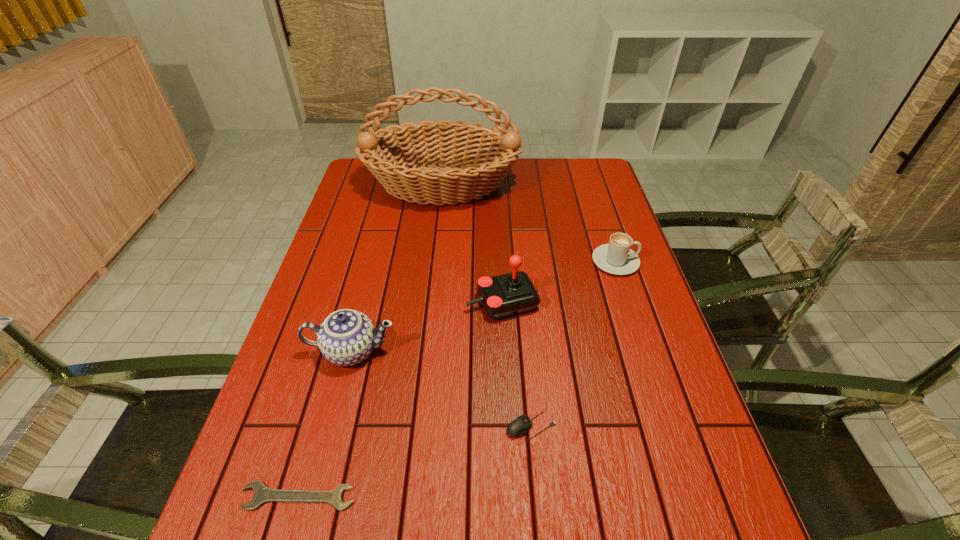
In order to click on wrench in this screenshot , I will do `click(263, 494)`.

The width and height of the screenshot is (960, 540). What are the coordinates of `the shortest object` in the screenshot? It's located at (263, 494).

The width and height of the screenshot is (960, 540). I want to click on blank area located on the right of the tallest object, so click(572, 185).

Find the location of a particular element. The width and height of the screenshot is (960, 540). vacant space located on the front of the fourth nearest object is located at coordinates (509, 430).

You are a GUI agent. You are given a task and a screenshot of the screen. Output one action in this format:
    pyautogui.click(x=<x>, y=<y>)
    Task: Click on the blank area located at the spout of the third nearest object
    
    Given the screenshot: What is the action you would take?
    pyautogui.click(x=325, y=454)

What are the coordinates of `vacant region located 0.360m on the back of the fifth tallest object` in the screenshot? It's located at (519, 292).

Locate an element on the screen. Image resolution: width=960 pixels, height=540 pixels. vacant region located 0.180m on the right of the wrench is located at coordinates (451, 496).

Find the location of a particular element. This screenshot has height=540, width=960. object located at the far edge is located at coordinates (400, 167).

Identify the location of basket that is positioned at the left edge. (400, 167).

This screenshot has width=960, height=540. In order to click on chinaware that is positioned at the left edge in this screenshot , I will do `click(346, 337)`.